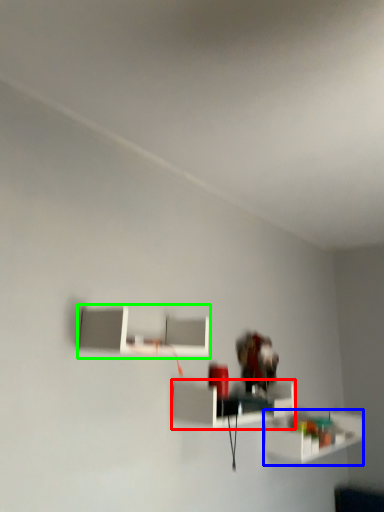
Question: Which is nearer to the shelf (highlighted by a red box)? shelf (highlighted by a blue box) or shelf (highlighted by a green box).

Choices:
 (A) shelf
 (B) shelf

Answer: (B)